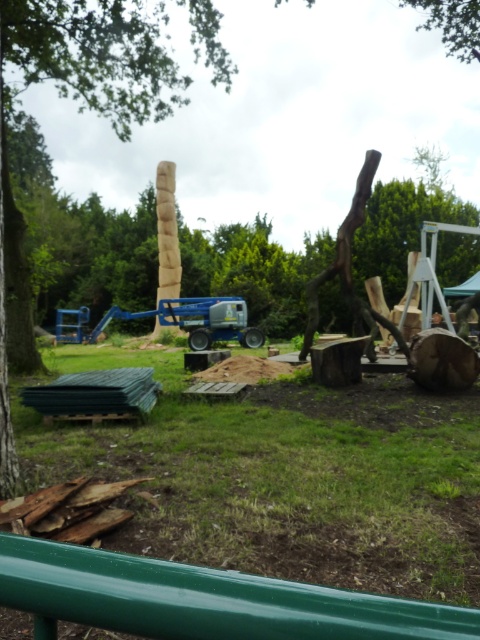
Question: Is green grass at center above brown rough tree trunk at left?

Choices:
 (A) yes
 (B) no

Answer: (B)

Question: Is green grass at center to the right of brown rough tree trunk at left from the viewer's perspective?

Choices:
 (A) no
 (B) yes

Answer: (B)

Question: Is green grass at center positioned behind brown rough tree trunk at left?

Choices:
 (A) no
 (B) yes

Answer: (A)